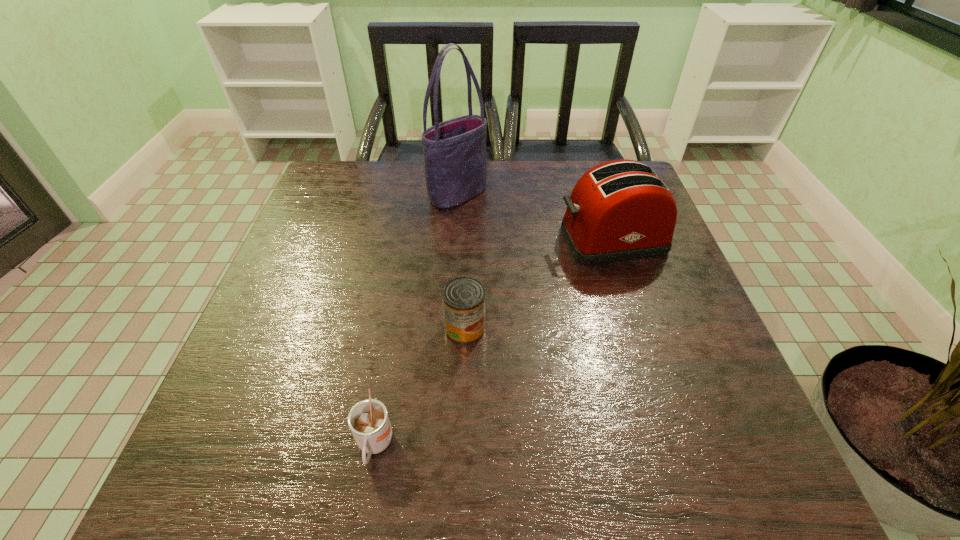
Where is `empty space that is in between the tallest object and the toaster`? The height and width of the screenshot is (540, 960). empty space that is in between the tallest object and the toaster is located at coordinates (535, 217).

At what (x,y) coordinates should I click in order to perform the action: click on free point between the leftmost object and the farthest object. Please return your answer as a coordinate pair (x, y). The width and height of the screenshot is (960, 540). Looking at the image, I should click on (417, 320).

This screenshot has width=960, height=540. What are the coordinates of `vacant space that's between the third nearest object and the tallest object` in the screenshot? It's located at (535, 217).

The image size is (960, 540). I want to click on free space between the farthest object and the nearest object, so click(x=417, y=320).

I want to click on free space between the second tallest object and the can, so click(538, 284).

What are the coordinates of `free space between the toaster and the nearest object` in the screenshot? It's located at (492, 342).

This screenshot has width=960, height=540. Identify the location of vacant area that lies between the toaster and the nearest object. (492, 342).

I want to click on free space between the nearest object and the can, so (x=420, y=387).

Identify which object is the nearest to the second nearest object. Please provide its 2D coordinates. Your answer should be formatted as a tuple, i.e. [(x, y)], where the tuple contains the x and y coordinates of a point satisfying the conditions above.

[(368, 420)]

Identify the location of object that is the closest one to the farthest object. This screenshot has height=540, width=960. (620, 210).